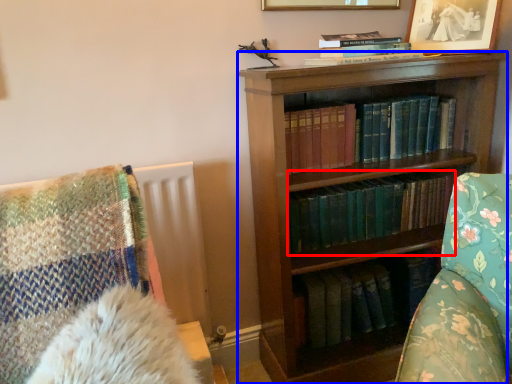
Question: Among these objects, which one is nearest to the camera, book (highlighted by a red box) or bookcase (highlighted by a blue box)?

Choices:
 (A) book
 (B) bookcase

Answer: (B)